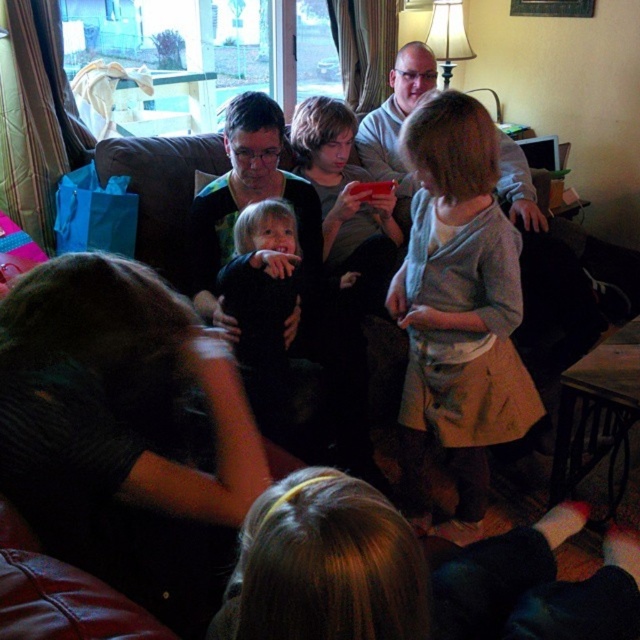
Question: Can you confirm if dark brown leather couch at lower left is positioned to the right of light gray knit sweater at center?

Choices:
 (A) no
 (B) yes

Answer: (A)

Question: Can you confirm if dark blue fabric baby at center is smaller than gray sweater at upper center?

Choices:
 (A) yes
 (B) no

Answer: (A)

Question: Which point is closer to the camera?

Choices:
 (A) matte black shirt at center
 (B) gray sweater at upper center
 (C) light gray knit sweater at center

Answer: (C)

Question: Estimate the real-world distances between objects in this image. Which object is farther from the dark blue fabric baby at center?

Choices:
 (A) light gray knit sweater at center
 (B) gray sweater at upper center
 (C) dark brown leather couch at lower left
 (D) matte black shirt at center

Answer: (B)

Question: Does dark brown leather couch at lower left appear under matte black shirt at center?

Choices:
 (A) no
 (B) yes

Answer: (B)

Question: Which point appears closest to the camera in this image?

Choices:
 (A) (445, 532)
 (B) (266, 115)
 (C) (273, 240)
 (D) (36, 294)

Answer: (D)